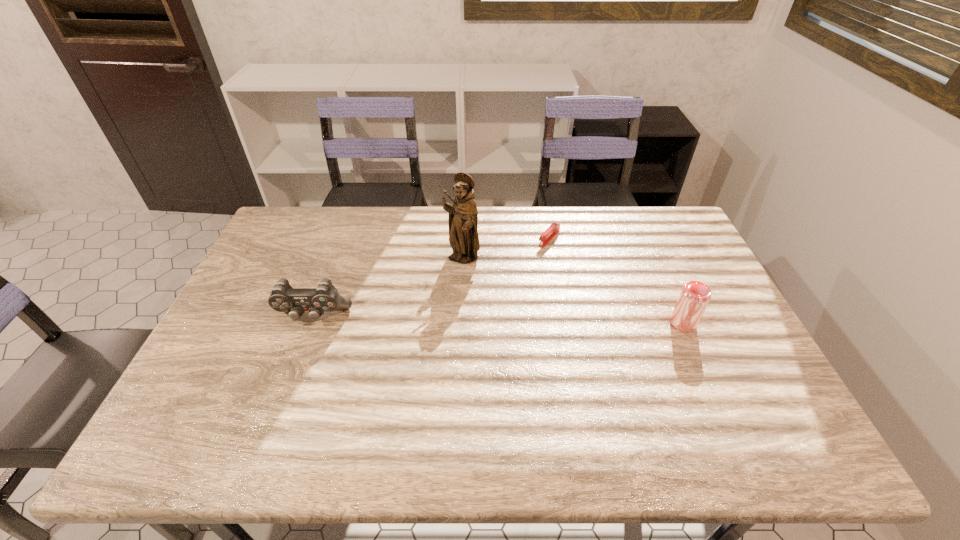
Where is `unoccupied area between the beer can and the control`? unoccupied area between the beer can and the control is located at coordinates (498, 320).

Find the location of a particular element. free space between the tallest object and the second object from right to left is located at coordinates (506, 249).

Locate an element on the screen. unoccupied area between the second object from right to left and the control is located at coordinates (431, 278).

I want to click on object that is the closest to the tallest object, so click(x=554, y=228).

The image size is (960, 540). In order to click on the closest object to the third object from right to left in this screenshot , I will do `click(554, 228)`.